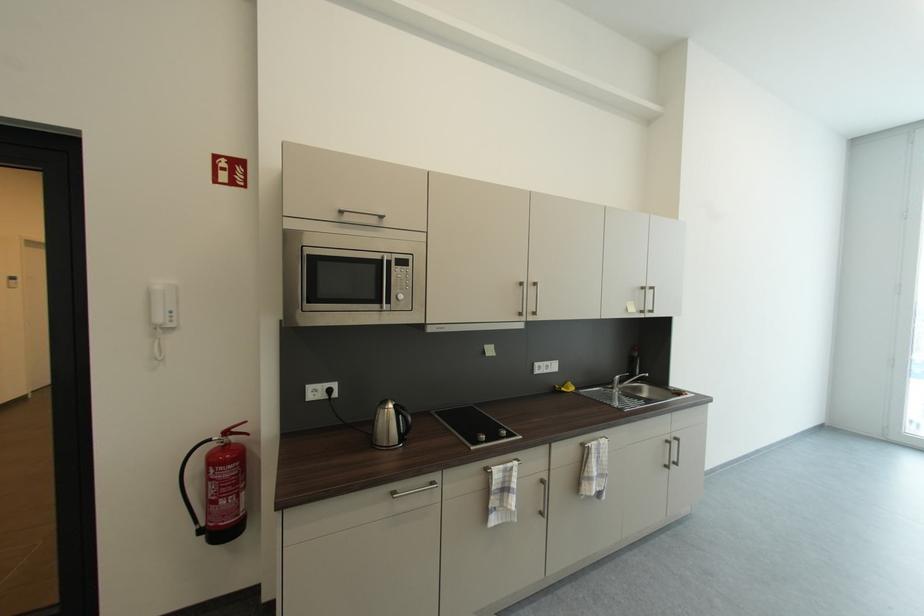
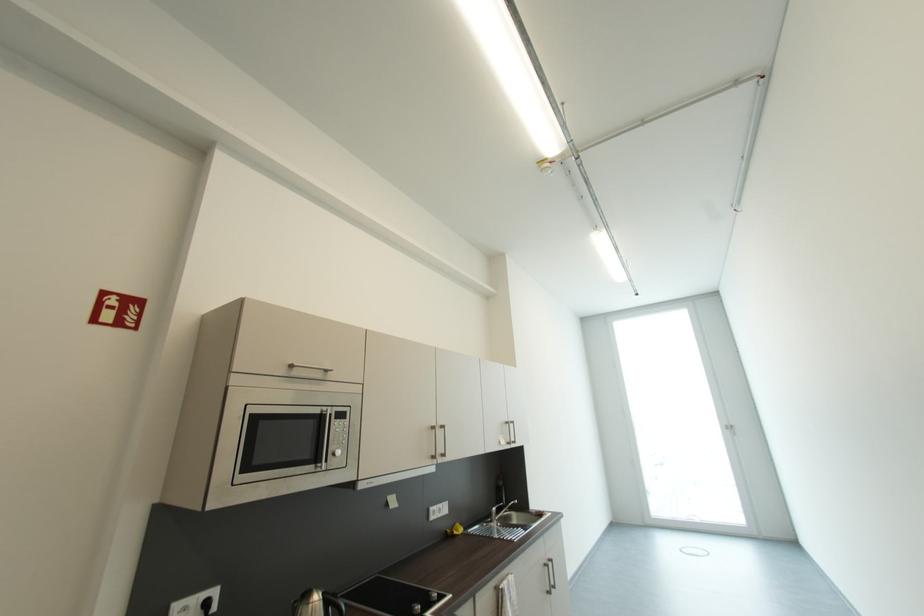
The first image is from the beginning of the video and the second image is from the end. How did the camera likely rotate when shooting the video?

The camera rotated toward right-up.